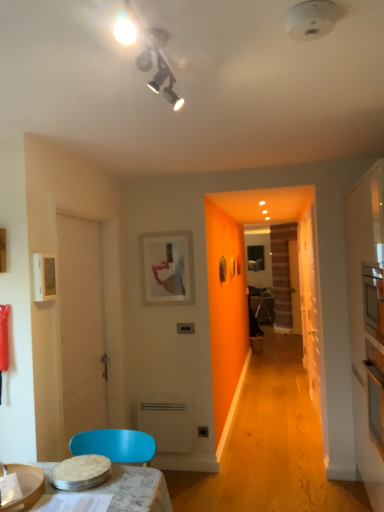
Describe the element at coordinates (167, 267) in the screenshot. I see `matte white picture frame at center, which appears as the 1th picture frame when viewed from the back` at that location.

Find the location of a particular element. white matte door at left is located at coordinates (81, 327).

The image size is (384, 512). Find the location of `transparent glass door at right`. transparent glass door at right is located at coordinates (310, 303).

This screenshot has height=512, width=384. What are the coordinates of `matte white picture frame at center, which appears as the 1th picture frame when viewed from the back` in the screenshot? It's located at (167, 267).

Are transparent glass door at right and white glossy microwave at right far apart?

transparent glass door at right is far away from white glossy microwave at right.

Considering the positions of points (304, 354) and (379, 360), is point (304, 354) closer to camera compared to point (379, 360)?

No, it is not.

Is the depth of transparent glass door at right greater than that of white glossy microwave at right?

Yes, it is.

From the picture: Considering the relative positions of transparent glass door at right and white glossy microwave at right in the image provided, is transparent glass door at right to the left of white glossy microwave at right from the viewer's perspective?

Yes, transparent glass door at right is to the left of white glossy microwave at right.

Which is more to the right, transparent glass door at right or matte white picture frame at upper left, which is counted as the second picture frame, starting from the back?

transparent glass door at right.

From the image's perspective, between transparent glass door at right and matte white picture frame at upper left, which is counted as the second picture frame, starting from the right, who is located below?

transparent glass door at right appears lower in the image.

Considering the sizes of objects transparent glass door at right and matte white picture frame at upper left, which is counted as the second picture frame, starting from the back, in the image provided, who is shorter, transparent glass door at right or matte white picture frame at upper left, which is counted as the second picture frame, starting from the back,?

With less height is matte white picture frame at upper left, which is counted as the second picture frame, starting from the back.

From the picture: Can you tell me how much transparent glass door at right and matte white picture frame at upper left, which is counted as the second picture frame, starting from the back, differ in facing direction?

They differ by 180 degrees in their facing directions.

Based on their sizes in the image, would you say matte white picture frame at center, the second picture frame when ordered from front to back, is bigger or smaller than transparent glass door at right?

matte white picture frame at center, the second picture frame when ordered from front to back, is smaller than transparent glass door at right.

Which is behind, point (192, 254) or point (315, 276)?

The point (192, 254) is farther from the camera.

Which of these two, matte white picture frame at center, which appears as the 1th picture frame when viewed from the back, or transparent glass door at right, stands taller?

Standing taller between the two is transparent glass door at right.

Which object is further away from the camera taking this photo, matte white picture frame at center, which ranks as the first picture frame in right-to-left order, or transparent glass door at right?

matte white picture frame at center, which ranks as the first picture frame in right-to-left order, is further from the camera.

Is matte white picture frame at upper left, which is counted as the second picture frame, starting from the right, oriented away from transparent glass door at right?

matte white picture frame at upper left, which is counted as the second picture frame, starting from the right, does not have its back to transparent glass door at right.

Between matte white picture frame at upper left, the 1th picture frame viewed from the front, and transparent glass door at right, which one has larger size?

With larger size is transparent glass door at right.

From a real-world perspective, is matte white picture frame at upper left, the 1th picture frame viewed from the front, above or below transparent glass door at right?

Clearly, from a real-world perspective, matte white picture frame at upper left, the 1th picture frame viewed from the front, is above transparent glass door at right.

Between matte white picture frame at upper left, which is counted as the second picture frame, starting from the back, and transparent glass door at right, which one has larger width?

Wider between the two is matte white picture frame at upper left, which is counted as the second picture frame, starting from the back.

Are white glossy microwave at right and transparent glass door at right beside each other?

No, white glossy microwave at right is not touching transparent glass door at right.

Can you confirm if white glossy microwave at right is shorter than transparent glass door at right?

In fact, white glossy microwave at right may be taller than transparent glass door at right.

Is white glossy microwave at right surrounding transparent glass door at right?

No, transparent glass door at right is located outside of white glossy microwave at right.

Based on the photo, can you tell me how much white glossy microwave at right and white plastic radiator at lower center differ in facing direction?

There is a 91-degree angle between the facing directions of white glossy microwave at right and white plastic radiator at lower center.

Considering the relative positions of white glossy microwave at right and white plastic radiator at lower center in the image provided, is white glossy microwave at right to the left of white plastic radiator at lower center from the viewer's perspective?

Incorrect, white glossy microwave at right is not on the left side of white plastic radiator at lower center.

In terms of height, does white glossy microwave at right look taller or shorter compared to white plastic radiator at lower center?

white glossy microwave at right is taller than white plastic radiator at lower center.

Can you confirm if white glossy microwave at right is wider than white plastic radiator at lower center?

Yes, white glossy microwave at right is wider than white plastic radiator at lower center.

From the image's perspective, is white glossy microwave at right under matte white picture frame at center, which appears as the second picture frame when viewed from the left?

Indeed, from the image's perspective, white glossy microwave at right is shown beneath matte white picture frame at center, which appears as the second picture frame when viewed from the left.

Can you confirm if white glossy microwave at right is bigger than matte white picture frame at center, which appears as the 1th picture frame when viewed from the back?

Indeed, white glossy microwave at right has a larger size compared to matte white picture frame at center, which appears as the 1th picture frame when viewed from the back.

How many degrees apart are the facing directions of white glossy microwave at right and matte white picture frame at center, which ranks as the first picture frame in right-to-left order?

The facing directions of white glossy microwave at right and matte white picture frame at center, which ranks as the first picture frame in right-to-left order, are 90.6 degrees apart.

Image resolution: width=384 pixels, height=512 pixels. What are the coordinates of `glass door that appears below the white glossy microwave at right (from a real-world perspective)` in the screenshot? It's located at (310, 303).

The height and width of the screenshot is (512, 384). In order to click on glass door below the matte white picture frame at upper left, the 1th picture frame viewed from the front (from the image's perspective) in this screenshot , I will do `click(310, 303)`.

From the image, which object appears to be farther from transparent glass door at right, white matte door at left or matte white picture frame at center, which appears as the second picture frame when viewed from the left?

white matte door at left is positioned further to the anchor transparent glass door at right.

When comparing their distances from white matte door at left, does white glossy microwave at right or transparent glass door at right seem closer?

white glossy microwave at right is closer to white matte door at left.

Based on their spatial positions, is white matte door at left or matte white picture frame at center, which ranks as the first picture frame in right-to-left order, further from matte white picture frame at upper left, which is counted as the second picture frame, starting from the right?

matte white picture frame at center, which ranks as the first picture frame in right-to-left order, is further to matte white picture frame at upper left, which is counted as the second picture frame, starting from the right.

When comparing their distances from matte white picture frame at center, which appears as the 1th picture frame when viewed from the back, does white plastic radiator at lower center or transparent glass door at right seem closer?

Based on the image, white plastic radiator at lower center appears to be nearer to matte white picture frame at center, which appears as the 1th picture frame when viewed from the back.

Which object lies nearer to the anchor point white plastic radiator at lower center, white glossy microwave at right or matte white picture frame at upper left, which is counted as the second picture frame, starting from the right?

Among the two, white glossy microwave at right is located nearer to white plastic radiator at lower center.

Based on the photo, which object lies further to the anchor point matte white picture frame at upper left, the 1th picture frame viewed from the front, white plastic radiator at lower center or transparent glass door at right?

transparent glass door at right lies further to matte white picture frame at upper left, the 1th picture frame viewed from the front, than the other object.

When comparing their distances from matte white picture frame at upper left, which is counted as the second picture frame, starting from the back, does white matte door at left or transparent glass door at right seem closer?

Based on the image, white matte door at left appears to be nearer to matte white picture frame at upper left, which is counted as the second picture frame, starting from the back.

Based on their spatial positions, is matte white picture frame at center, which appears as the second picture frame when viewed from the left, or white plastic radiator at lower center further from white matte door at left?

white plastic radiator at lower center is positioned further to the anchor white matte door at left.

Find the location of `picture frame between white plastic radiator at lower center and transparent glass door at right`. picture frame between white plastic radiator at lower center and transparent glass door at right is located at coordinates (167, 267).

Find the location of `picture frame located between matte white picture frame at upper left, which is counted as the second picture frame, starting from the right, and transparent glass door at right in the left-right direction`. picture frame located between matte white picture frame at upper left, which is counted as the second picture frame, starting from the right, and transparent glass door at right in the left-right direction is located at coordinates (167, 267).

The height and width of the screenshot is (512, 384). Identify the location of appliance between matte white picture frame at upper left, the 1th picture frame when ordered from left to right, and white glossy microwave at right. (166, 422).

Locate an element on the screen. This screenshot has height=512, width=384. glass door between white glossy microwave at right and white plastic radiator at lower center along the z-axis is located at coordinates click(x=310, y=303).